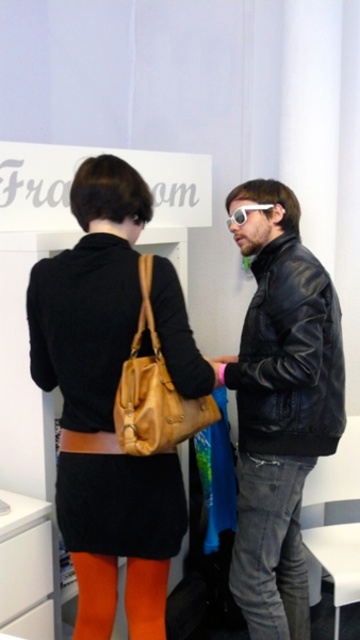
Can you confirm if denim jeans at lower center is wider than leather handbag at center?

Indeed, denim jeans at lower center has a greater width compared to leather handbag at center.

Which of these two, denim jeans at lower center or leather handbag at center, stands shorter?

With less height is leather handbag at center.

This screenshot has width=360, height=640. What are the coordinates of `denim jeans at lower center` in the screenshot? It's located at (271, 547).

This screenshot has width=360, height=640. I want to click on denim jeans at lower center, so click(x=271, y=547).

Consider the image. Can you confirm if black leather jacket at center is taller than denim jeans at lower center?

Indeed, black leather jacket at center has a greater height compared to denim jeans at lower center.

Which of these two, black leather jacket at center or denim jeans at lower center, stands taller?

black leather jacket at center is taller.

You are a GUI agent. You are given a task and a screenshot of the screen. Output one action in this format:
    pyautogui.click(x=<x>, y=<y>)
    Task: Click on the black leather jacket at center
    Image resolution: width=360 pixels, height=640 pixels.
    Given the screenshot: What is the action you would take?
    pyautogui.click(x=280, y=406)

Image resolution: width=360 pixels, height=640 pixels. I want to click on black leather jacket at center, so click(x=280, y=406).

Is black leather jacket at center thinner than white matte goggles at center?

In fact, black leather jacket at center might be wider than white matte goggles at center.

Measure the distance from black leather jacket at center to white matte goggles at center.

21.28 inches

Where is `black leather jacket at center`? This screenshot has width=360, height=640. black leather jacket at center is located at coordinates (280, 406).

The width and height of the screenshot is (360, 640). What are the coordinates of `black leather jacket at center` in the screenshot? It's located at (280, 406).